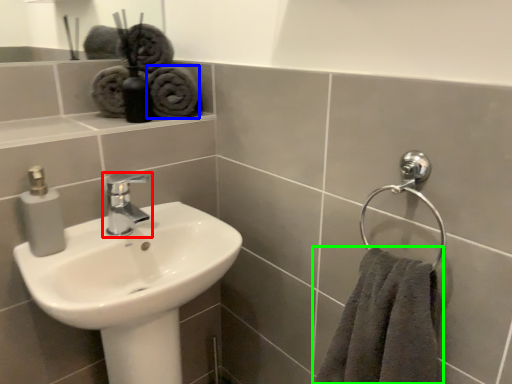
Question: Which object is the closest to the tap (highlighted by a red box)? Choose among these: material (highlighted by a blue box) or towel (highlighted by a green box).

Choices:
 (A) material
 (B) towel

Answer: (A)